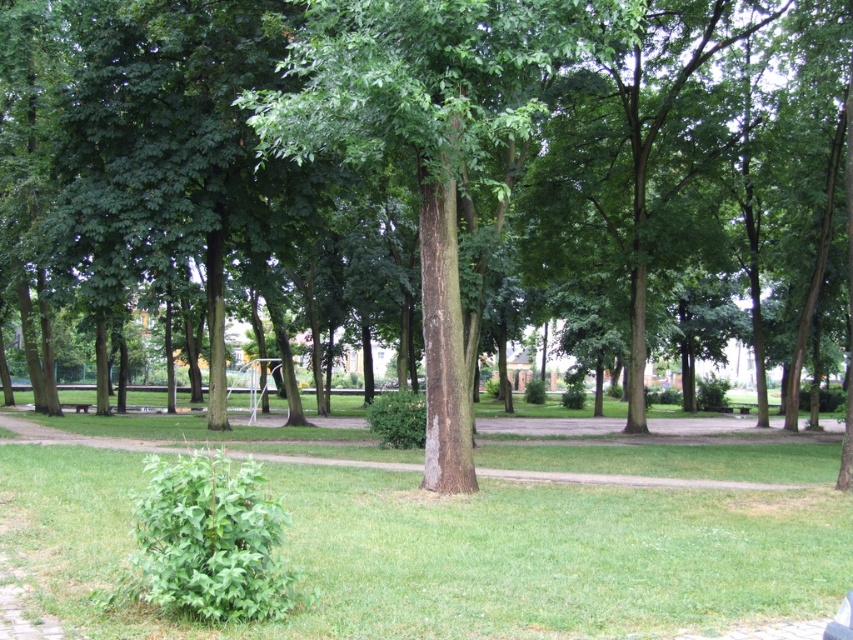
Question: Which object is farther from the camera taking this photo?

Choices:
 (A) green grass at center
 (B) green rough bark tree at center
 (C) wooden park bench at lower left

Answer: (C)

Question: Can you confirm if green grass at center is thinner than wooden park bench at lower left?

Choices:
 (A) no
 (B) yes

Answer: (A)

Question: Is green grass at center below wooden park bench at lower left?

Choices:
 (A) no
 (B) yes

Answer: (A)

Question: Which point is farther from the camera taking this photo?

Choices:
 (A) (531, 81)
 (B) (149, 624)
 (C) (85, 408)

Answer: (C)

Question: Which point is farther from the camera taking this photo?

Choices:
 (A) (344, 40)
 (B) (74, 404)

Answer: (B)

Question: Does green rough bark tree at center lie in front of wooden park bench at lower left?

Choices:
 (A) yes
 (B) no

Answer: (A)